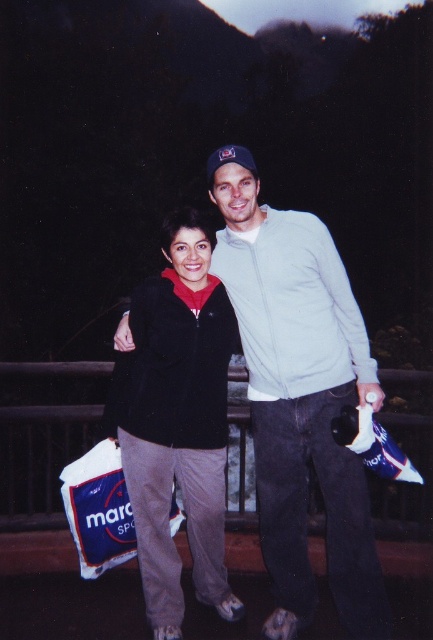
Question: Among these objects, which one is nearest to the camera?

Choices:
 (A) light gray cotton jacket at center
 (B) black fleece jacket at center

Answer: (B)

Question: Considering the relative positions of light gray cotton jacket at center and black fleece jacket at center in the image provided, where is light gray cotton jacket at center located with respect to black fleece jacket at center?

Choices:
 (A) above
 (B) below

Answer: (A)

Question: Which point is farther to the camera?

Choices:
 (A) black fleece jacket at center
 (B) light gray cotton jacket at center

Answer: (B)

Question: Among these objects, which one is nearest to the camera?

Choices:
 (A) black fleece jacket at center
 (B) light gray cotton jacket at center

Answer: (A)

Question: Is light gray cotton jacket at center to the left of black fleece jacket at center from the viewer's perspective?

Choices:
 (A) yes
 (B) no

Answer: (B)

Question: Can you confirm if light gray cotton jacket at center is positioned below black fleece jacket at center?

Choices:
 (A) yes
 (B) no

Answer: (B)